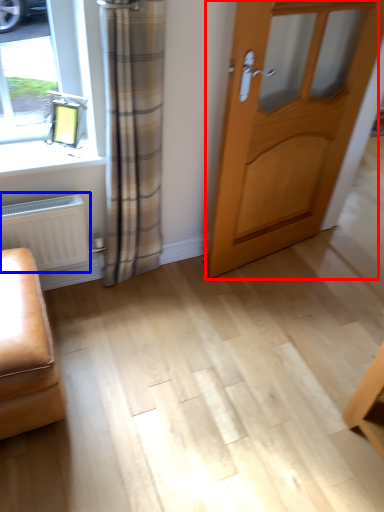
Question: Which object is further to the camera taking this photo, door (highlighted by a red box) or radiator (highlighted by a blue box)?

Choices:
 (A) door
 (B) radiator

Answer: (B)